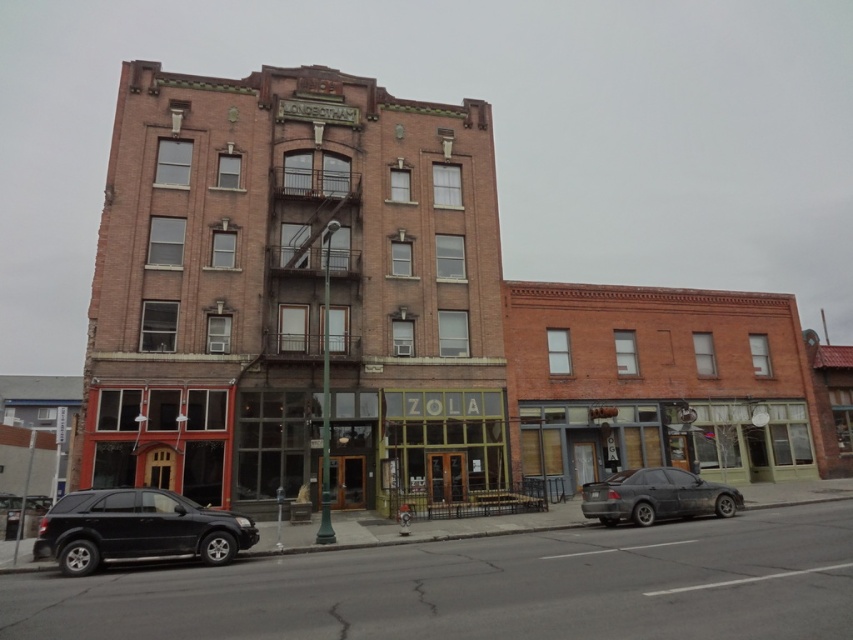
Which is more to the right, matte black suv at lower left or dark gray matte sedan at lower right?

dark gray matte sedan at lower right

Does matte black suv at lower left have a lesser height compared to dark gray matte sedan at lower right?

No, matte black suv at lower left is not shorter than dark gray matte sedan at lower right.

Between point (51, 512) and point (706, 484), which one is positioned behind?

The point (706, 484) is behind.

Where is `matte black suv at lower left`? Image resolution: width=853 pixels, height=640 pixels. matte black suv at lower left is located at coordinates (137, 529).